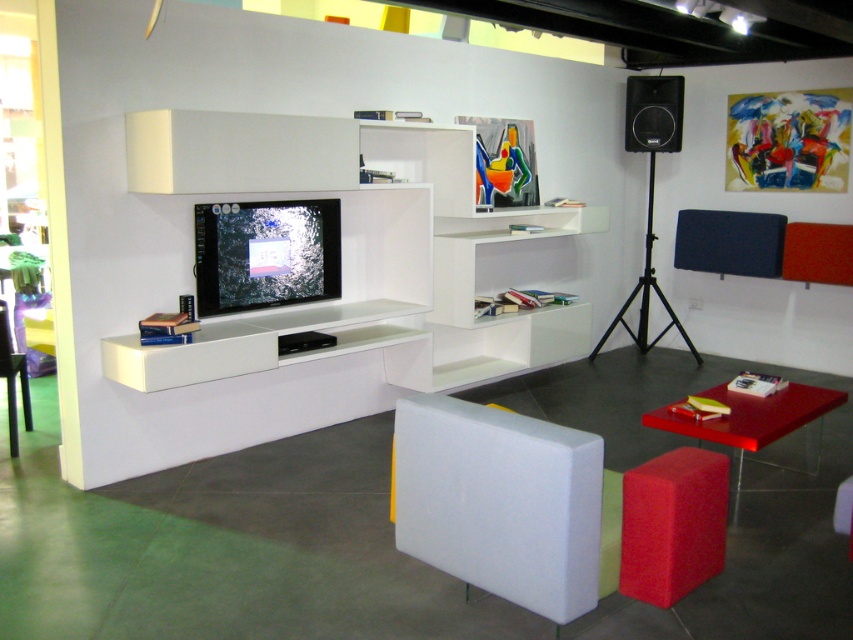
Is point (635, 140) behind point (10, 444)?

Yes, point (635, 140) is behind point (10, 444).

Can you confirm if black matte speaker at upper right is positioned above matte black chair at lower left?

Yes.

Does point (648, 108) come behind point (9, 406)?

Yes, point (648, 108) is behind point (9, 406).

The height and width of the screenshot is (640, 853). Identify the location of black matte speaker at upper right. (653, 113).

Which is more to the left, rubberized red stool at lower right or black matte speaker at upper right?

rubberized red stool at lower right is more to the left.

Between rubberized red stool at lower right and black matte speaker at upper right, which one is positioned higher?

black matte speaker at upper right

Is point (625, 480) positioned behind point (635, 138)?

No, it is not.

This screenshot has width=853, height=640. Find the location of `rubberized red stool at lower right`. rubberized red stool at lower right is located at coordinates (672, 524).

Which is above, white foam chair at center or matte black chair at lower left?

Positioned higher is matte black chair at lower left.

What do you see at coordinates (506, 502) in the screenshot? This screenshot has width=853, height=640. I see `white foam chair at center` at bounding box center [506, 502].

Does point (569, 488) lie behind point (15, 404)?

No, it is in front of (15, 404).

This screenshot has width=853, height=640. I want to click on white foam chair at center, so click(506, 502).